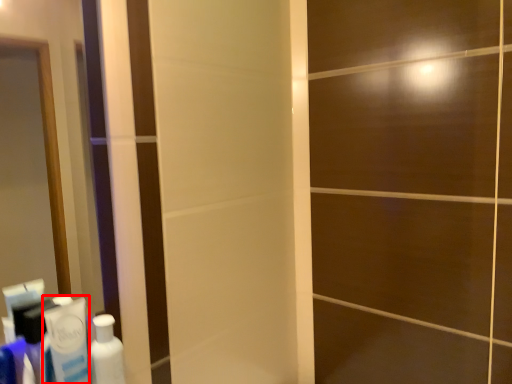
Question: From the image's perspective, considering the relative positions of toothpaste (annotated by the red box) and bottle in the image provided, where is toothpaste (annotated by the red box) located with respect to the staircase?

Choices:
 (A) below
 (B) above

Answer: (B)